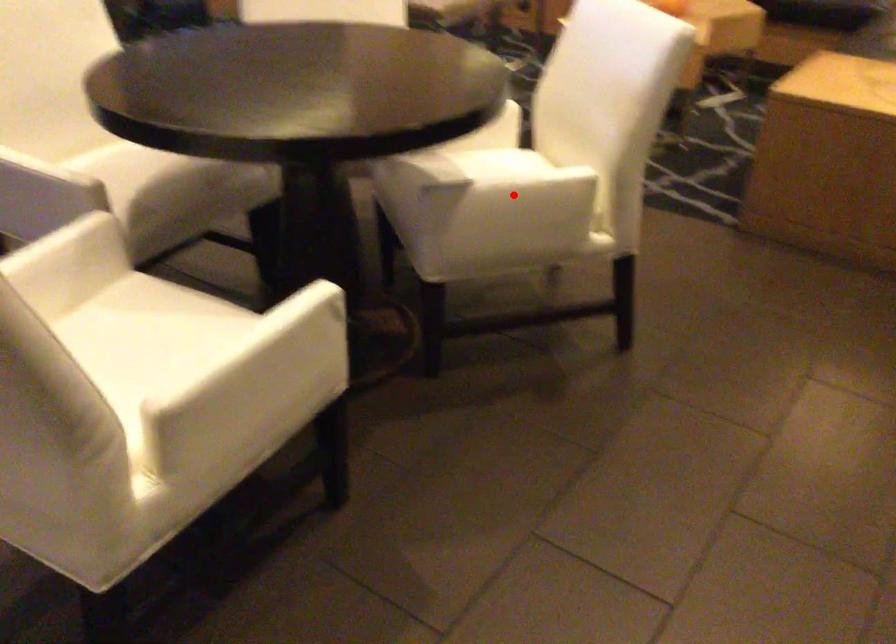
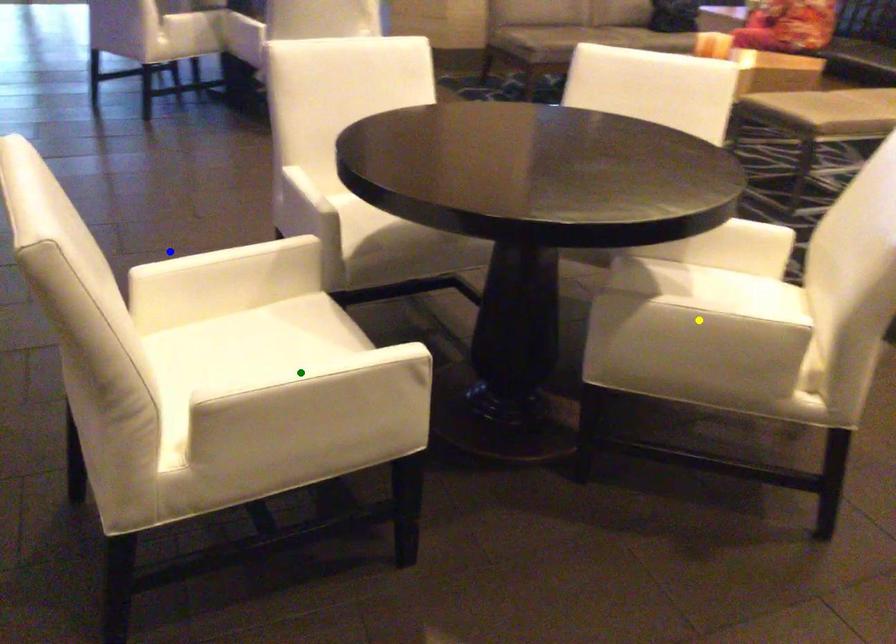
Question: I am providing you with two images of the same scene from different viewpoints. A red point is marked on the first image. You are given multiple points on the second image. In image 2, which mark is for the same physical point as the one in image 1?

Choices:
 (A) green point
 (B) yellow point
 (C) blue point

Answer: (B)